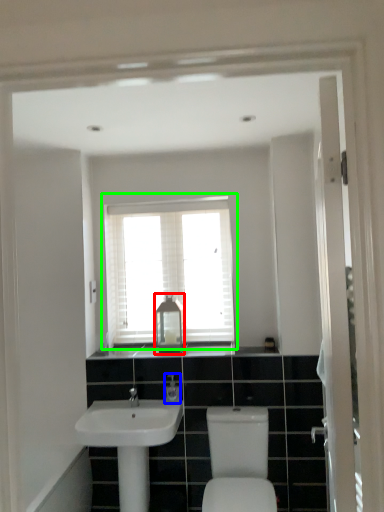
Question: Based on their relative distances, which object is nearer to medicine cabinet (highlighted by a red box)? Choose from toiletry (highlighted by a blue box) and window (highlighted by a green box).

Choices:
 (A) toiletry
 (B) window

Answer: (B)